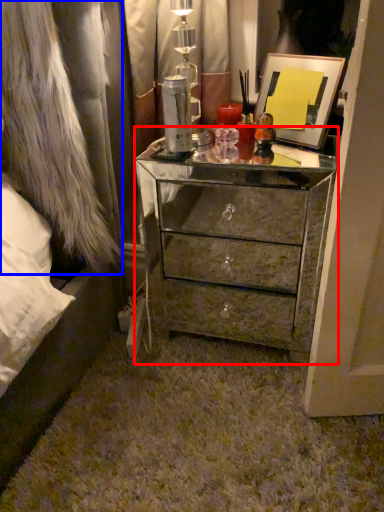
Question: Among these objects, which one is nearest to the camera, chest of drawers (highlighted by a red box) or fur coat (highlighted by a blue box)?

Choices:
 (A) chest of drawers
 (B) fur coat

Answer: (B)